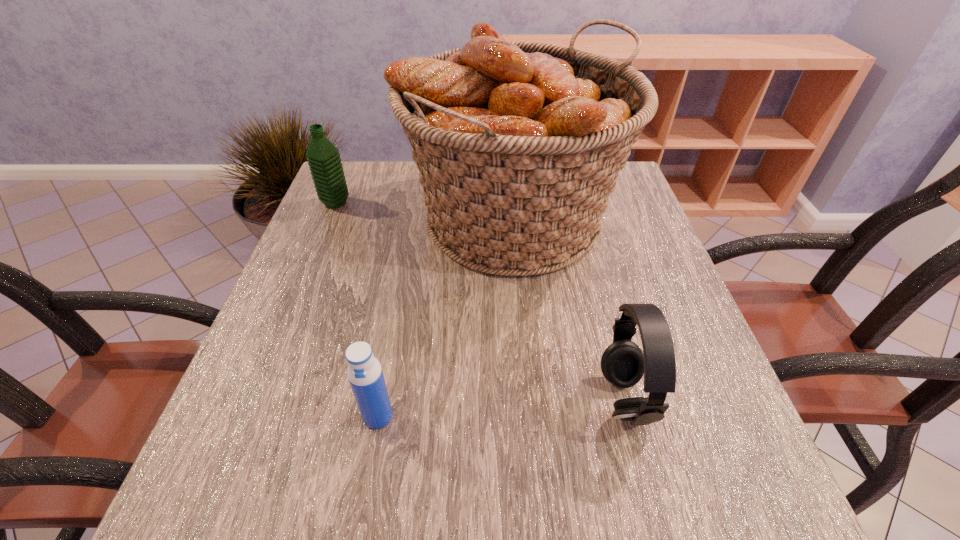
This screenshot has width=960, height=540. Identify the location of free space that is in between the taller water bottle and the nearer water bottle. (357, 309).

Image resolution: width=960 pixels, height=540 pixels. Identify the location of vacant area that lies between the nearer water bottle and the earphone. (501, 407).

Where is `vacant space that's between the shorter water bottle and the earphone`? vacant space that's between the shorter water bottle and the earphone is located at coordinates (501, 407).

This screenshot has width=960, height=540. Identify the location of vacant space that is in between the right water bottle and the earphone. (501, 407).

Where is `vacant space that's between the shorter water bottle and the leftmost object`? The width and height of the screenshot is (960, 540). vacant space that's between the shorter water bottle and the leftmost object is located at coordinates (357, 309).

Locate an element on the screen. The width and height of the screenshot is (960, 540). the closest object to the earphone is located at coordinates (518, 144).

The image size is (960, 540). In order to click on object that can be found as the closest to the tallest object in this screenshot , I will do pyautogui.click(x=623, y=363).

You are a GUI agent. You are given a task and a screenshot of the screen. Output one action in this format:
    pyautogui.click(x=<x>, y=<y>)
    Task: Click on the free region that satisfies the following two spatial constraints: 1. on the front side of the farther water bottle; 2. on the left side of the basket
    Image resolution: width=960 pixels, height=540 pixels.
    Given the screenshot: What is the action you would take?
    pyautogui.click(x=329, y=219)

Image resolution: width=960 pixels, height=540 pixels. I want to click on blank area in the image that satisfies the following two spatial constraints: 1. on the front side of the tallest object; 2. on the right side of the farther water bottle, so click(329, 219).